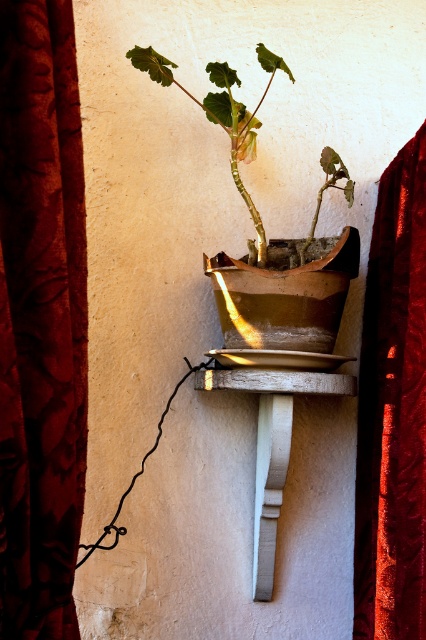
You are standing in front of the shelf with the potted plant and want to reach the velvet dark red curtain at left. Can you estimate how far you need to stretch your hand to touch it?

The velvet dark red curtain at left is 33.77 inches away from the camera, so you would need to stretch your hand approximately 33.77 inches to touch it.

You are standing in front of the wall with the shelf and need to place a decorative item between the velvet dark red curtain at left and the matte brown pot at center. Where should you place it to ensure it is centered between them?

The velvet dark red curtain at left is to the left of matte brown pot at center, so placing the decorative item midway between them would center it between the curtain and the pot.

You are a painter who needs to hang a 12 inch wide painting on the wall between the velvet dark red curtain at left and the white painted wood at center. Can the painting fit in the space between them?

The distance between the velvet dark red curtain at left and the white painted wood at center is 14.91 inches. Since the painting is 12 inches wide, it can fit in the space between them as there is enough room.